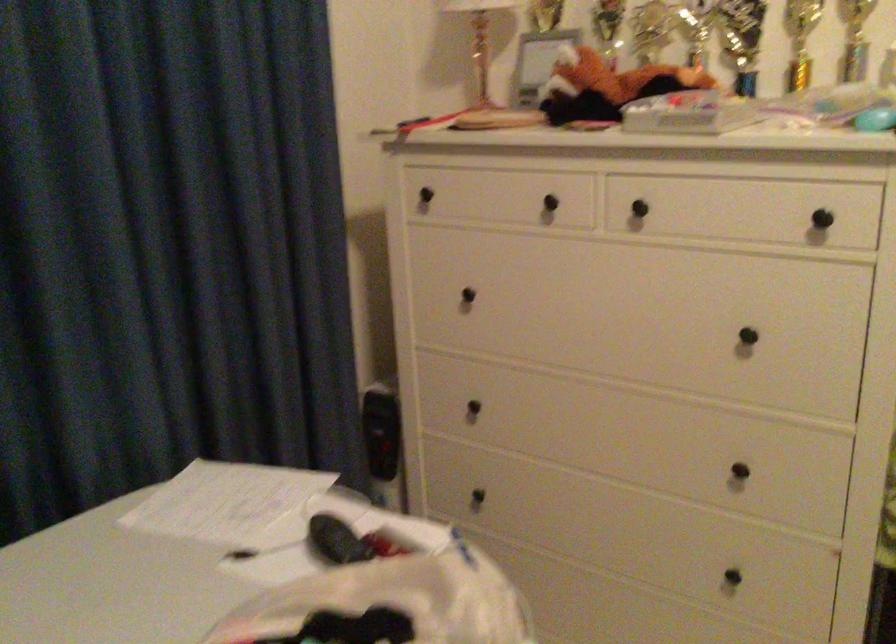
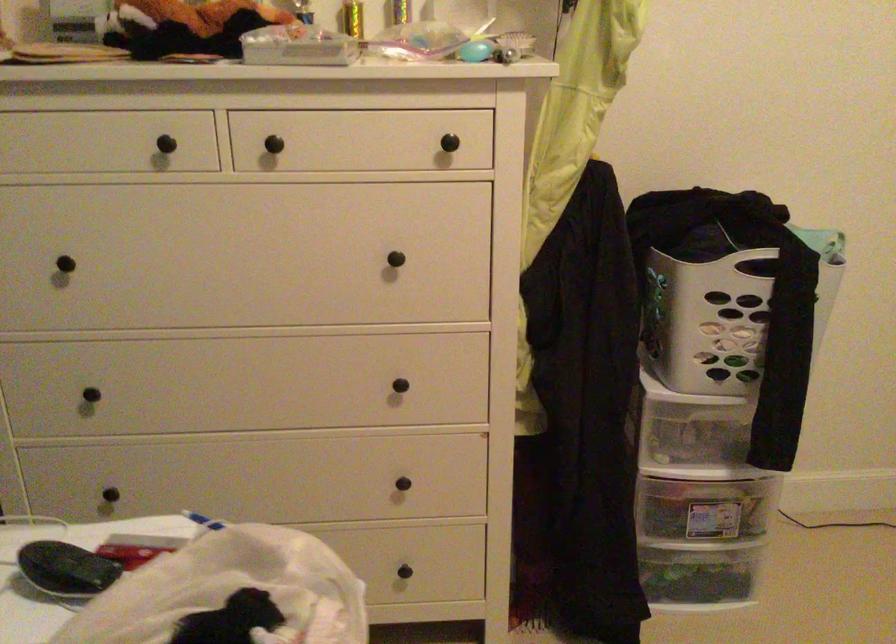
Locate, in the second image, the point that corresponds to point 556,202 in the first image.

(173, 142)